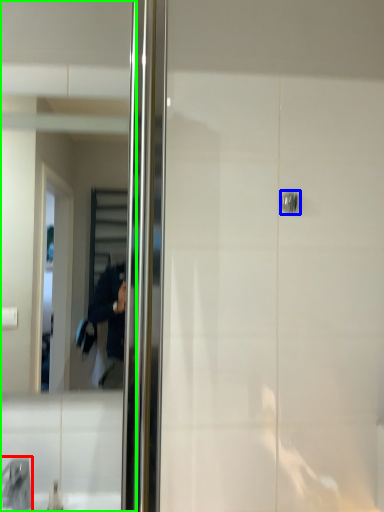
Question: Which object is the closest to the faucet (highlighted by a red box)? Choose among these: door handle (highlighted by a blue box) or mirror (highlighted by a green box).

Choices:
 (A) door handle
 (B) mirror

Answer: (B)